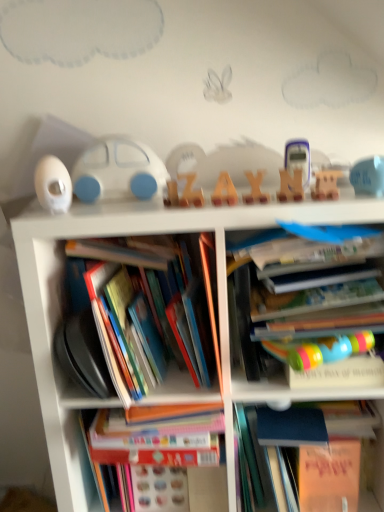
Question: Does blue matte book at right, which appears as the 1th book when viewed from the right, have a lesser height compared to wooden letter at center, the second toy from the right?

Choices:
 (A) yes
 (B) no

Answer: (B)

Question: From the image's perspective, is blue matte book at right, which appears as the 1th book when viewed from the right, beneath wooden letter at center, acting as the fourth toy starting from the left?

Choices:
 (A) yes
 (B) no

Answer: (A)

Question: From a real-world perspective, does blue matte book at right, positioned as the 4th book in left-to-right order, sit lower than wooden letter at center, the second toy from the right?

Choices:
 (A) yes
 (B) no

Answer: (A)

Question: Is blue matte book at right, which appears as the 1th book when viewed from the right, positioned with its back to wooden letter at center, acting as the fourth toy starting from the left?

Choices:
 (A) yes
 (B) no

Answer: (B)

Question: Is blue matte book at right, which appears as the 1th book when viewed from the right, positioned behind wooden letter at center, acting as the fourth toy starting from the left?

Choices:
 (A) no
 (B) yes

Answer: (B)

Question: Is translucent plastic calculator at center, which is counted as the 3th toy, starting from the right, in front of or behind blue matte book at right, positioned as the 4th book in left-to-right order, in the image?

Choices:
 (A) front
 (B) behind

Answer: (B)

Question: From the image's perspective, is translucent plastic calculator at center, positioned as the 3th toy in left-to-right order, positioned above or below blue matte book at right, positioned as the 4th book in left-to-right order?

Choices:
 (A) above
 (B) below

Answer: (A)

Question: Does point (292, 157) appear closer or farther from the camera than point (256, 455)?

Choices:
 (A) closer
 (B) farther

Answer: (A)

Question: Is translucent plastic calculator at center, which is counted as the 3th toy, starting from the right, to the left or to the right of blue matte book at right, which appears as the 1th book when viewed from the right, in the image?

Choices:
 (A) right
 (B) left

Answer: (B)

Question: From the image's perspective, is white matte toy car at center positioned above or below blue rubber duck at upper right, the 5th toy when ordered from left to right?

Choices:
 (A) below
 (B) above

Answer: (B)

Question: Looking at the image, does white matte toy car at center seem bigger or smaller compared to blue rubber duck at upper right, which is the 1th toy in right-to-left order?

Choices:
 (A) small
 (B) big

Answer: (B)

Question: From a real-world perspective, is white matte toy car at center physically located above or below blue rubber duck at upper right, the 5th toy when ordered from left to right?

Choices:
 (A) below
 (B) above

Answer: (B)

Question: Considering the positions of white matte toy car at center and blue rubber duck at upper right, which is the 1th toy in right-to-left order, in the image, is white matte toy car at center taller or shorter than blue rubber duck at upper right, which is the 1th toy in right-to-left order,?

Choices:
 (A) short
 (B) tall

Answer: (B)

Question: Is point [x=314, y=177] closer or farther from the camera than point [x=342, y=434]?

Choices:
 (A) farther
 (B) closer

Answer: (B)

Question: Is wooden letter at center, the second toy from the right, taller or shorter than blue matte book at right, which appears as the 1th book when viewed from the right?

Choices:
 (A) tall
 (B) short

Answer: (B)